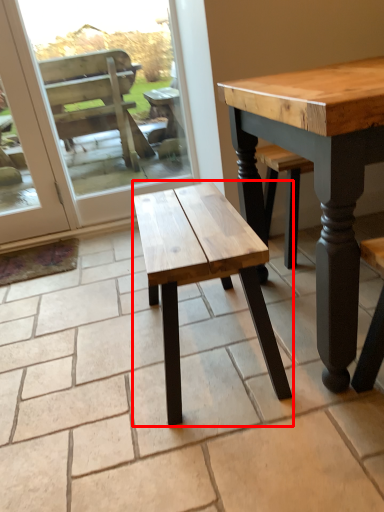
Question: In this image, where is stool (annotated by the red box) located relative to screen door?

Choices:
 (A) right
 (B) left

Answer: (A)